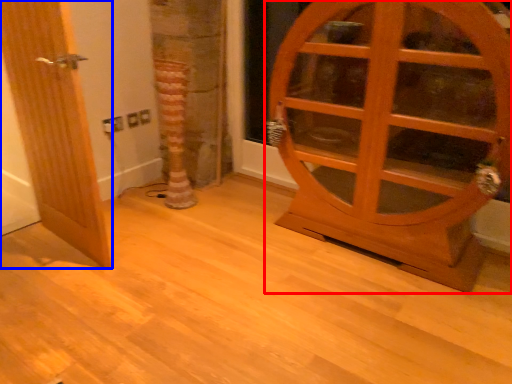
Question: Among these objects, which one is farthest to the camera, door (highlighted by a red box) or door (highlighted by a blue box)?

Choices:
 (A) door
 (B) door

Answer: (B)